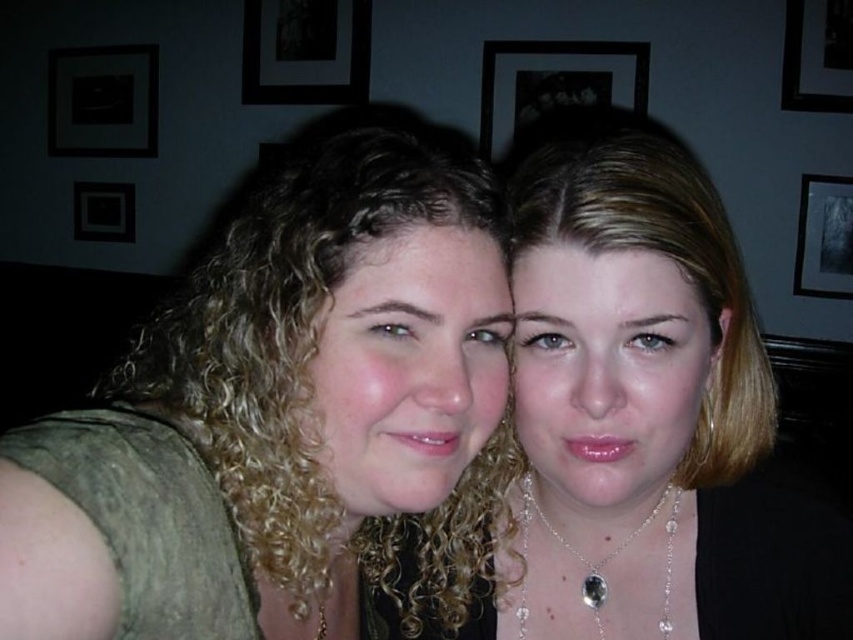
Question: Estimate the real-world distances between objects in this image. Which object is farther from the black matte picture frame at upper center?

Choices:
 (A) dark matte picture frame at upper left
 (B) black matte picture frame at upper left

Answer: (B)

Question: Which of the following is the closest to the observer?

Choices:
 (A) (585, 580)
 (B) (315, 28)

Answer: (A)

Question: Which object appears farthest from the camera in this image?

Choices:
 (A) black matte picture frame at upper center
 (B) curly blonde hair at left
 (C) black matte picture frame at upper right
 (D) silver/glass pendant necklace at lower center

Answer: (A)

Question: Is black matte picture frame at upper center to the left of black matte picture frame at upper left from the viewer's perspective?

Choices:
 (A) no
 (B) yes

Answer: (A)

Question: Does black matte picture frame at upper left come behind black matte picture frame at upper right?

Choices:
 (A) yes
 (B) no

Answer: (A)

Question: Can you confirm if black glossy picture frame at upper right is positioned above silver/glass pendant necklace at lower center?

Choices:
 (A) yes
 (B) no

Answer: (A)